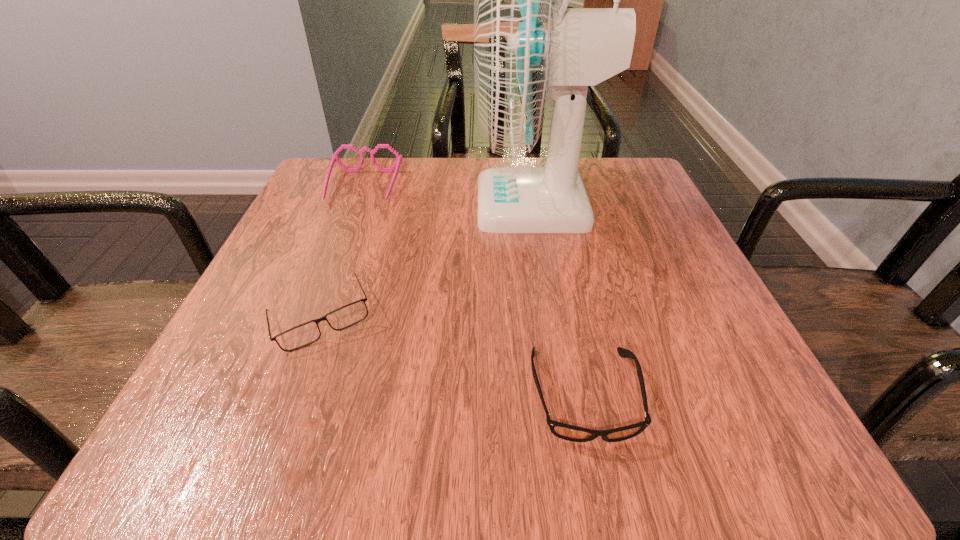
You are a GUI agent. You are given a task and a screenshot of the screen. Output one action in this format:
    pyautogui.click(x=<x>, y=<y>)
    Task: Click on the fan
    
    Given the screenshot: What is the action you would take?
    pyautogui.click(x=529, y=47)

The height and width of the screenshot is (540, 960). Find the location of `the tallest spectacles`. the tallest spectacles is located at coordinates (334, 157).

In order to click on the farthest spectacles in this screenshot , I will do `click(334, 157)`.

Locate an element on the screen. the shortest spectacles is located at coordinates (564, 431).

Where is `the rightmost spectacles`? the rightmost spectacles is located at coordinates (564, 431).

Image resolution: width=960 pixels, height=540 pixels. Find the location of `vacant region located in front of the tallest object to face the airflow`. vacant region located in front of the tallest object to face the airflow is located at coordinates (406, 205).

Where is `vacant space situated in front of the tallest object to face the airflow`? This screenshot has width=960, height=540. vacant space situated in front of the tallest object to face the airflow is located at coordinates (446, 205).

Locate an element on the screen. vacant space located in front of the tallest object to face the airflow is located at coordinates (401, 205).

Where is `free location located 0.260m on the arms of the farthest spectacles`? The image size is (960, 540). free location located 0.260m on the arms of the farthest spectacles is located at coordinates (322, 298).

The width and height of the screenshot is (960, 540). What are the coordinates of `fan present at the far edge` in the screenshot? It's located at (529, 47).